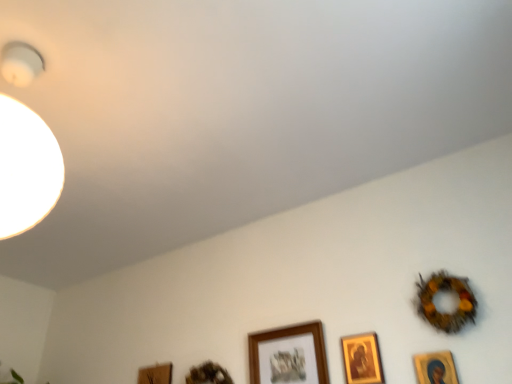
Question: Considering their positions, is gold-framed picture at lower right, the 1th picture frame from the right, located in front of or behind gold-framed picture at lower right, arranged as the second picture frame when viewed from the right?

Choices:
 (A) behind
 (B) front

Answer: (B)

Question: Is point click(x=417, y=367) closer or farther from the camera than point click(x=361, y=377)?

Choices:
 (A) farther
 (B) closer

Answer: (B)

Question: Which object is positioned farthest from the wooden frame at lower center, arranged as the 4th picture frame when viewed from the right?

Choices:
 (A) gold-framed picture at lower right, arranged as the 4th picture frame when viewed from the left
 (B) gold-framed picture at lower right, which is counted as the 5th picture frame, starting from the left
 (C) wooden frame at lower center, arranged as the 3th picture frame when viewed from the right
 (D) wooden frame at lower center, the 1th picture frame in the left-to-right sequence

Answer: (B)

Question: Which object is positioned farthest from the wooden frame at lower center, arranged as the 4th picture frame when viewed from the right?

Choices:
 (A) gold-framed picture at lower right, the 1th picture frame from the right
 (B) wooden frame at lower center, which is the fifth picture frame from right to left
 (C) wooden frame at lower center, acting as the third picture frame starting from the left
 (D) gold-framed picture at lower right, arranged as the second picture frame when viewed from the right

Answer: (A)